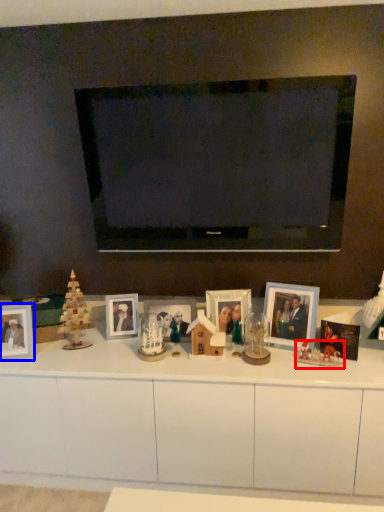
Question: Which object appears farthest to the camera in this image, toy (highlighted by a red box) or picture frame (highlighted by a blue box)?

Choices:
 (A) toy
 (B) picture frame

Answer: (B)